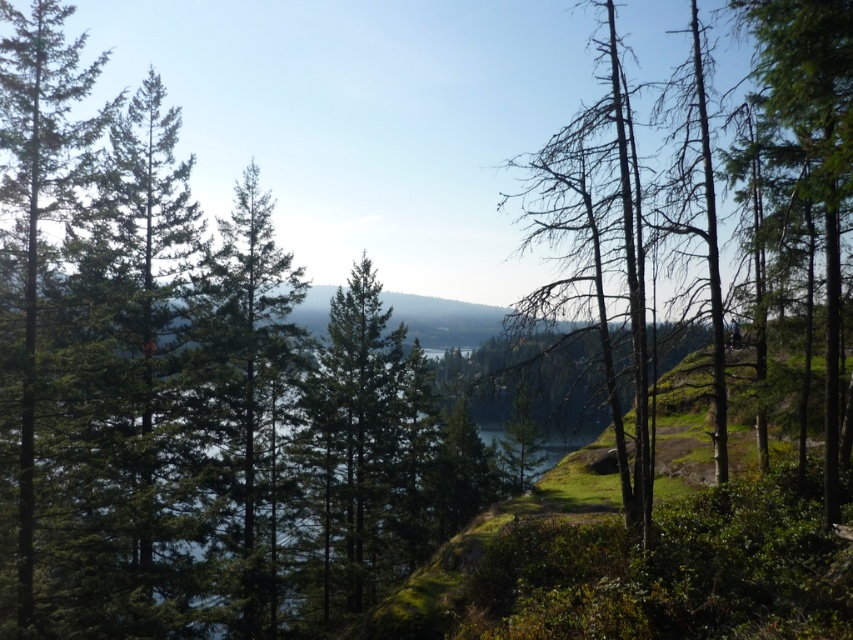
Can you confirm if green matte tree at left is wider than green matte tree at right?

Yes.

Can you confirm if green matte tree at left is smaller than green matte tree at right?

Incorrect, green matte tree at left is not smaller in size than green matte tree at right.

Is point (28, 20) behind point (759, 35)?

Yes, point (28, 20) is farther from viewer.

This screenshot has height=640, width=853. What are the coordinates of `green matte tree at left` in the screenshot? It's located at (38, 196).

Who is lower down, green matte tree at center or green matte tree at right?

green matte tree at center is below.

Can you confirm if green matte tree at center is thinner than green matte tree at right?

Correct, green matte tree at center's width is less than green matte tree at right's.

I want to click on green matte tree at center, so click(x=250, y=378).

Can you confirm if green matte tree at center is taller than green matte tree at left?

Incorrect, green matte tree at center's height is not larger of green matte tree at left's.

Can you confirm if green matte tree at center is positioned to the left of green matte tree at left?

No, green matte tree at center is not to the left of green matte tree at left.

Find the location of a particular element. Image resolution: width=853 pixels, height=640 pixels. green matte tree at center is located at coordinates (250, 378).